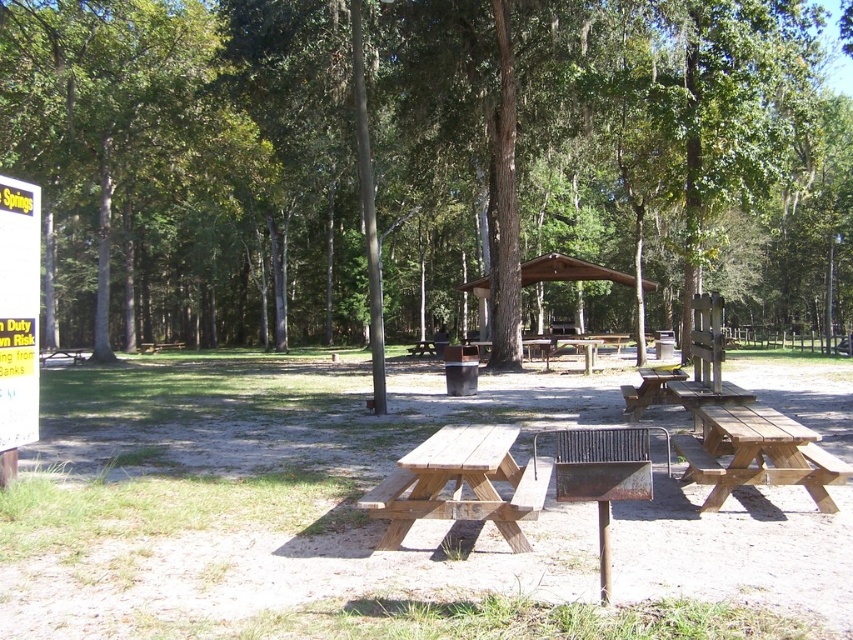
Question: Which of the following is the farthest from the observer?

Choices:
 (A) green leafy tree at left
 (B) brown wood tree at center
 (C) natural wood picnic table at center

Answer: (A)

Question: Which of the following is the farthest from the observer?

Choices:
 (A) light brown wooden picnic table at center
 (B) green leafy tree at left

Answer: (B)

Question: Can you confirm if natural wood picnic table at center is positioned to the left of light brown wooden picnic table at center?

Choices:
 (A) yes
 (B) no

Answer: (A)

Question: Is brown wood tree at center positioned at the back of green leafy tree at left?

Choices:
 (A) yes
 (B) no

Answer: (B)

Question: Does brown wood tree at center have a lesser width compared to light brown wooden picnic table at center?

Choices:
 (A) no
 (B) yes

Answer: (A)

Question: Which is nearer to the natural wood picnic table at center?

Choices:
 (A) green leafy tree at left
 (B) light brown wooden picnic table at center
 (C) brown wood tree at center

Answer: (B)